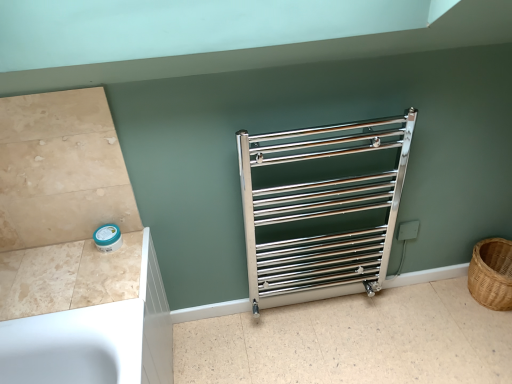
Question: Is beige marble counter top at lower left inside the boundaries of brown woven basket at right, or outside?

Choices:
 (A) inside
 (B) outside

Answer: (B)

Question: From a real-world perspective, is beige marble counter top at lower left above or below brown woven basket at right?

Choices:
 (A) above
 (B) below

Answer: (A)

Question: Based on their relative distances, which object is farther from the beige marble counter top at lower left?

Choices:
 (A) metallic silver towel rack at center
 (B) brown woven basket at right
 (C) polished chrome towel rack at center

Answer: (B)

Question: Based on their relative distances, which object is nearer to the metallic silver towel rack at center?

Choices:
 (A) brown woven basket at right
 (B) beige marble counter top at lower left
 (C) polished chrome towel rack at center

Answer: (C)